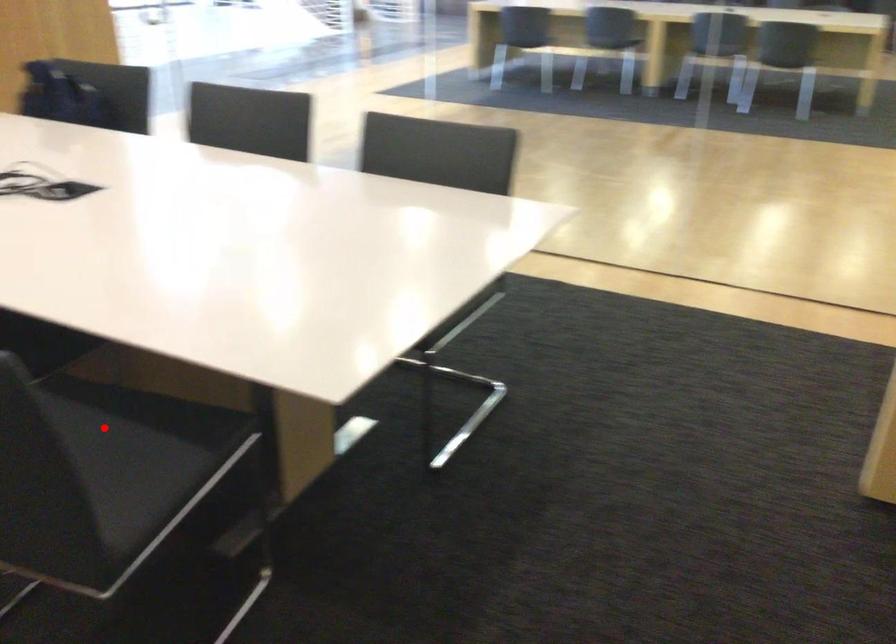
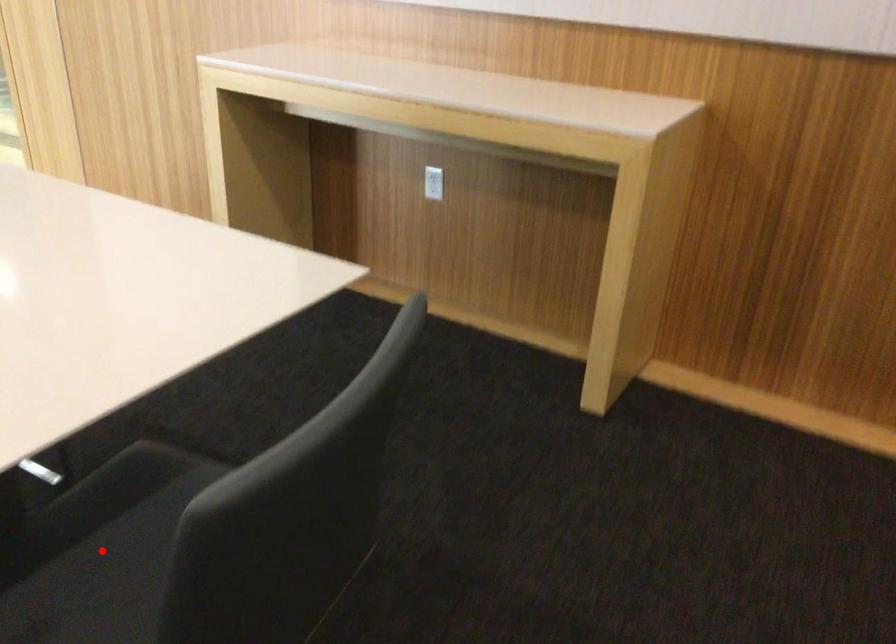
I am providing you with two images of the same scene from different viewpoints. A red point is marked on the first image and another point is marked on the second image. Do the highlighted points in image1 and image2 indicate the same real-world spot?

Yes